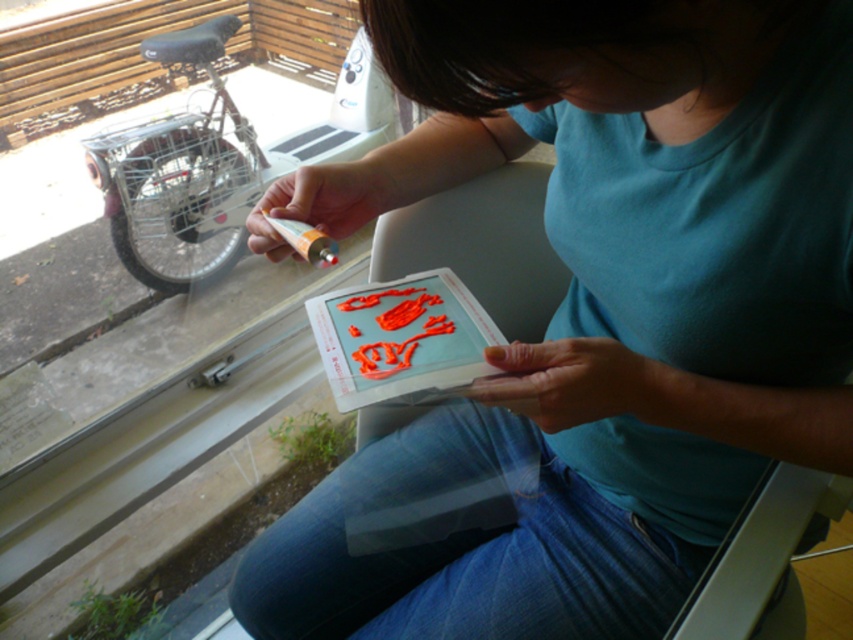
Consider the image. Which is above, matte orange marker at center or glossy plastic card at center?

Positioned higher is glossy plastic card at center.

Is point (831, 262) behind point (498, 344)?

No, (831, 262) is closer to viewer.

Find the location of a particular element. The width and height of the screenshot is (853, 640). matte orange marker at center is located at coordinates (x=596, y=308).